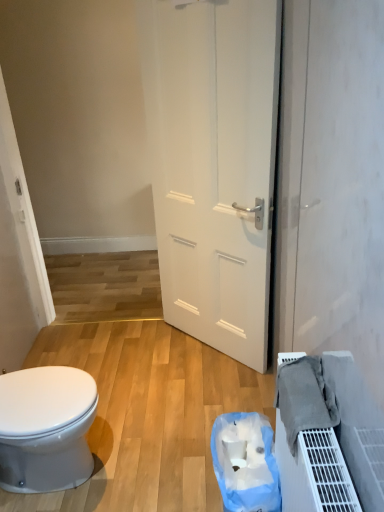
What are the coordinates of `free space in front of white matte door at center` in the screenshot? It's located at (195, 396).